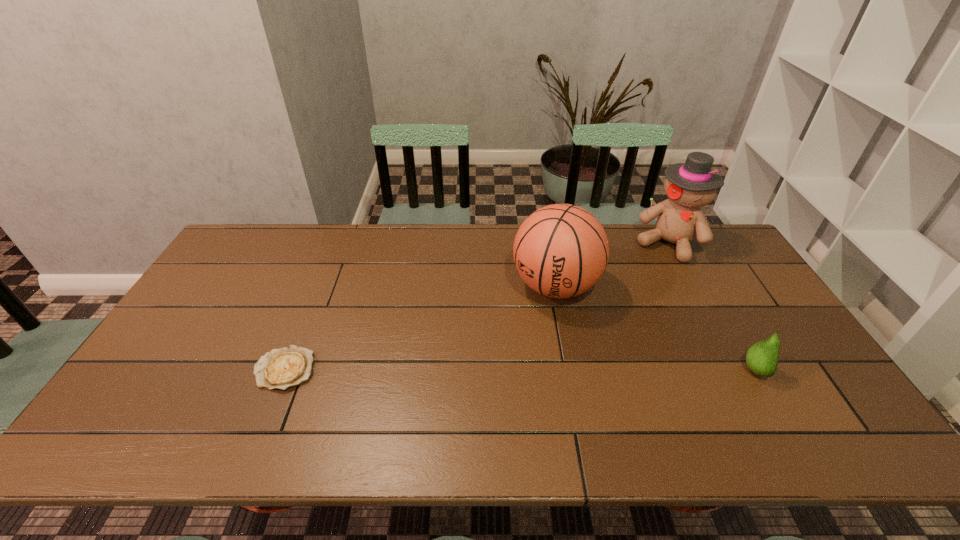
Locate an element on the screen. The height and width of the screenshot is (540, 960). object positioned at the near right corner is located at coordinates (762, 358).

Where is `vacant space at the far edge of the desktop`? vacant space at the far edge of the desktop is located at coordinates (310, 239).

The image size is (960, 540). I want to click on vacant space at the near edge of the desktop, so click(305, 395).

At what (x,y) coordinates should I click in order to perform the action: click on free spot at the left edge of the desktop. Please return your answer as a coordinate pair (x, y). Looking at the image, I should click on (215, 334).

Where is `free space at the right edge`? Image resolution: width=960 pixels, height=540 pixels. free space at the right edge is located at coordinates (742, 302).

The image size is (960, 540). In the image, there is a desktop. In order to click on free region at the far left corner in this screenshot , I will do `click(228, 252)`.

Identify the location of empty location between the rag_doll and the second object from left to right. (612, 265).

Where is `empty space between the shortest object and the basketball`? empty space between the shortest object and the basketball is located at coordinates (420, 328).

The height and width of the screenshot is (540, 960). In order to click on vacant area that lies between the shortest object and the avocado in this screenshot , I will do click(x=518, y=370).

Locate an element on the screen. The width and height of the screenshot is (960, 540). free space between the basketball and the leftmost object is located at coordinates (420, 328).